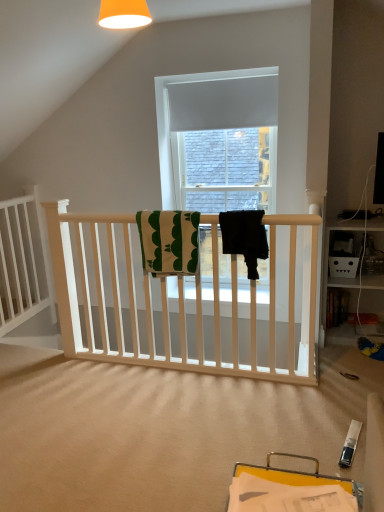
Identify the location of black fabric towel at center, the second beach towel in the left-to-right sequence. This screenshot has width=384, height=512. (245, 237).

Locate an element on the screen. The height and width of the screenshot is (512, 384). white wooden bed frame at left is located at coordinates (24, 264).

Is white wooden bed frame at left positioned in front of black fabric towel at center, the second beach towel in the left-to-right sequence?

No, it is not.

From the image's perspective, between white wooden bed frame at left and black fabric towel at center, the 1th beach towel from the right, which one is located above?

From the image's view, black fabric towel at center, the 1th beach towel from the right, is above.

Can you confirm if white wooden bed frame at left is thinner than black fabric towel at center, the second beach towel in the left-to-right sequence?

Yes, white wooden bed frame at left is thinner than black fabric towel at center, the second beach towel in the left-to-right sequence.

In terms of height, does white wooden bed frame at left look taller or shorter compared to black fabric towel at center, the second beach towel in the left-to-right sequence?

white wooden bed frame at left is taller than black fabric towel at center, the second beach towel in the left-to-right sequence.

Considering the relative sizes of green and white textured towel at center, marked as the 1th beach towel in a left-to-right arrangement, and white wooden bed frame at left in the image provided, is green and white textured towel at center, marked as the 1th beach towel in a left-to-right arrangement, bigger than white wooden bed frame at left?

Actually, green and white textured towel at center, marked as the 1th beach towel in a left-to-right arrangement, might be smaller than white wooden bed frame at left.

Is green and white textured towel at center, the second beach towel when ordered from right to left, inside the boundaries of white wooden bed frame at left, or outside?

The correct answer is: outside.

Locate an element on the screen. The height and width of the screenshot is (512, 384). bed frame that appears below the green and white textured towel at center, marked as the 1th beach towel in a left-to-right arrangement (from a real-world perspective) is located at coordinates (24, 264).

Can you confirm if green and white textured towel at center, the second beach towel when ordered from right to left, is taller than white wooden bed frame at left?

No.

Measure the distance from black fabric towel at center, the 1th beach towel from the right, to green and white textured towel at center, marked as the 1th beach towel in a left-to-right arrangement.

They are 11.96 inches apart.

From a real-world perspective, is black fabric towel at center, the second beach towel in the left-to-right sequence, above or below green and white textured towel at center, marked as the 1th beach towel in a left-to-right arrangement?

Clearly, from a real-world perspective, black fabric towel at center, the second beach towel in the left-to-right sequence, is above green and white textured towel at center, marked as the 1th beach towel in a left-to-right arrangement.

Considering the positions of objects black fabric towel at center, the second beach towel in the left-to-right sequence, and green and white textured towel at center, marked as the 1th beach towel in a left-to-right arrangement, in the image provided, who is in front, black fabric towel at center, the second beach towel in the left-to-right sequence, or green and white textured towel at center, marked as the 1th beach towel in a left-to-right arrangement,?

black fabric towel at center, the second beach towel in the left-to-right sequence, is more forward.

Where is `beach towel on the left of black fabric towel at center, the 1th beach towel from the right`? The width and height of the screenshot is (384, 512). beach towel on the left of black fabric towel at center, the 1th beach towel from the right is located at coordinates click(x=169, y=242).

From the picture: From the image's perspective, which one is positioned lower, white wooden bed frame at left or green and white textured towel at center, the second beach towel when ordered from right to left?

white wooden bed frame at left, from the image's perspective.

Can you confirm if white wooden bed frame at left is smaller than green and white textured towel at center, marked as the 1th beach towel in a left-to-right arrangement?

No.

Is white wooden bed frame at left next to green and white textured towel at center, the second beach towel when ordered from right to left, and touching it?

There is a gap between white wooden bed frame at left and green and white textured towel at center, the second beach towel when ordered from right to left.

How different are the orientations of white wooden bed frame at left and green and white textured towel at center, the second beach towel when ordered from right to left, in degrees?

They differ by 89.7 degrees in their facing directions.

From a real-world perspective, which is physically above, black fabric towel at center, the second beach towel in the left-to-right sequence, or white wooden bed frame at left?

From a 3D spatial view, black fabric towel at center, the second beach towel in the left-to-right sequence, is above.

Is black fabric towel at center, the second beach towel in the left-to-right sequence, in front of or behind white wooden bed frame at left in the image?

Clearly, black fabric towel at center, the second beach towel in the left-to-right sequence, is in front of white wooden bed frame at left.

Does black fabric towel at center, the second beach towel in the left-to-right sequence, have a lesser height compared to white wooden bed frame at left?

Correct, black fabric towel at center, the second beach towel in the left-to-right sequence, is not as tall as white wooden bed frame at left.

Could black fabric towel at center, the 1th beach towel from the right, be considered to be inside green and white textured towel at center, the second beach towel when ordered from right to left?

No.

Which is more to the left, green and white textured towel at center, marked as the 1th beach towel in a left-to-right arrangement, or black fabric towel at center, the second beach towel in the left-to-right sequence?

green and white textured towel at center, marked as the 1th beach towel in a left-to-right arrangement.

From the image's perspective, is green and white textured towel at center, the second beach towel when ordered from right to left, located beneath black fabric towel at center, the second beach towel in the left-to-right sequence?

Correct, green and white textured towel at center, the second beach towel when ordered from right to left, appears lower than black fabric towel at center, the second beach towel in the left-to-right sequence, in the image.

Based on their sizes in the image, would you say green and white textured towel at center, marked as the 1th beach towel in a left-to-right arrangement, is bigger or smaller than black fabric towel at center, the second beach towel in the left-to-right sequence?

green and white textured towel at center, marked as the 1th beach towel in a left-to-right arrangement, is bigger than black fabric towel at center, the second beach towel in the left-to-right sequence.

Locate an element on the screen. The width and height of the screenshot is (384, 512). the 2nd beach towel positioned above the white wooden bed frame at left (from a real-world perspective) is located at coordinates (245, 237).

At what (x,y) coordinates should I click in order to perform the action: click on the 1st beach towel to the right of the white wooden bed frame at left, counting from the anchor's position. Please return your answer as a coordinate pair (x, y). Looking at the image, I should click on (169, 242).

When comparing their distances from green and white textured towel at center, marked as the 1th beach towel in a left-to-right arrangement, does black fabric towel at center, the second beach towel in the left-to-right sequence, or white wooden bed frame at left seem closer?

Based on the image, black fabric towel at center, the second beach towel in the left-to-right sequence, appears to be nearer to green and white textured towel at center, marked as the 1th beach towel in a left-to-right arrangement.

Looking at the image, which one is located closer to white wooden bed frame at left, black fabric towel at center, the 1th beach towel from the right, or green and white textured towel at center, the second beach towel when ordered from right to left?

green and white textured towel at center, the second beach towel when ordered from right to left, is closer to white wooden bed frame at left.

From the image, which object appears to be nearer to green and white textured towel at center, marked as the 1th beach towel in a left-to-right arrangement, white wooden bed frame at left or black fabric towel at center, the second beach towel in the left-to-right sequence?

black fabric towel at center, the second beach towel in the left-to-right sequence, is positioned closer to the anchor green and white textured towel at center, marked as the 1th beach towel in a left-to-right arrangement.

Estimate the real-world distances between objects in this image. Which object is closer to black fabric towel at center, the 1th beach towel from the right, green and white textured towel at center, marked as the 1th beach towel in a left-to-right arrangement, or white wooden bed frame at left?

green and white textured towel at center, marked as the 1th beach towel in a left-to-right arrangement, is positioned closer to the anchor black fabric towel at center, the 1th beach towel from the right.

Based on their spatial positions, is green and white textured towel at center, the second beach towel when ordered from right to left, or black fabric towel at center, the second beach towel in the left-to-right sequence, further from white wooden bed frame at left?

The object further to white wooden bed frame at left is black fabric towel at center, the second beach towel in the left-to-right sequence.

Based on their spatial positions, is white wooden bed frame at left or green and white textured towel at center, marked as the 1th beach towel in a left-to-right arrangement, closer to black fabric towel at center, the second beach towel in the left-to-right sequence?

Among the two, green and white textured towel at center, marked as the 1th beach towel in a left-to-right arrangement, is located nearer to black fabric towel at center, the second beach towel in the left-to-right sequence.

The height and width of the screenshot is (512, 384). In order to click on beach towel located between white wooden bed frame at left and black fabric towel at center, the second beach towel in the left-to-right sequence, in the left-right direction in this screenshot , I will do `click(169, 242)`.